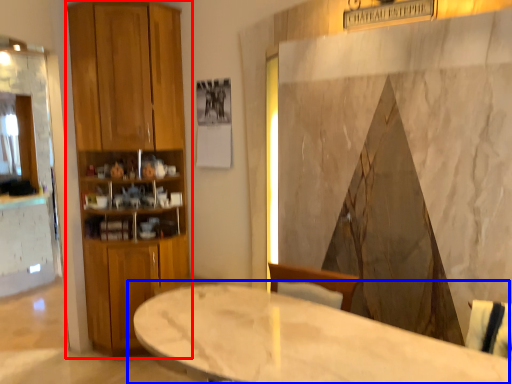
Question: Which point is closer to the camera, closet (highlighted by a red box) or table (highlighted by a blue box)?

Choices:
 (A) closet
 (B) table

Answer: (B)